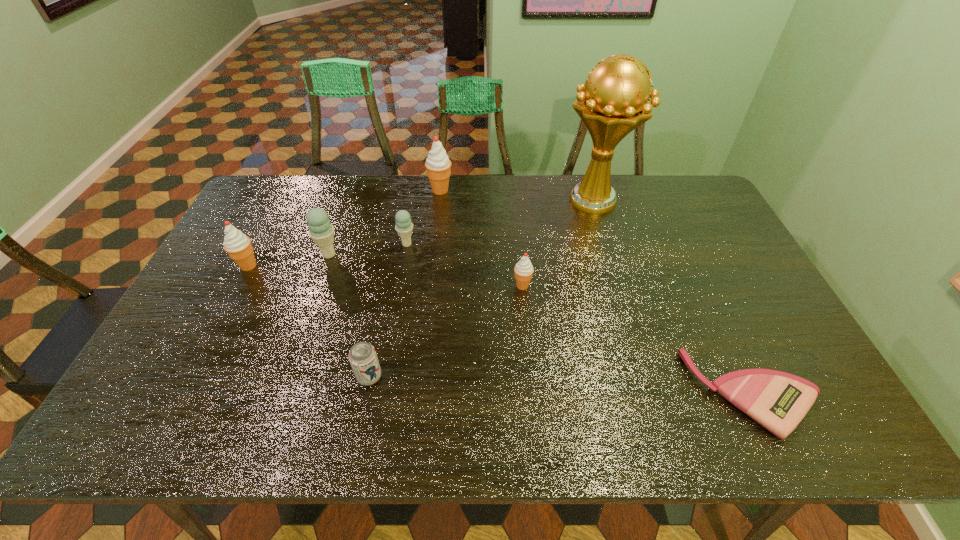
Where is `red icecream that is the closest to the seventh tallest object`? red icecream that is the closest to the seventh tallest object is located at coordinates click(x=523, y=269).

Locate an element on the screen. This screenshot has height=540, width=960. free space that satisfies the following two spatial constraints: 1. on the back side of the tallest icecream; 2. on the right side of the second icecream from left to right is located at coordinates (351, 190).

Locate an element on the screen. free space in the image that satisfies the following two spatial constraints: 1. on the front side of the tallest icecream; 2. on the right side of the smallest red icecream is located at coordinates (430, 286).

The width and height of the screenshot is (960, 540). In order to click on free space that satisfies the following two spatial constraints: 1. on the front side of the nearest red icecream; 2. on the left side of the farthest red icecream in this screenshot , I will do `click(430, 286)`.

Where is `blank space that satisfies the following two spatial constraints: 1. on the back side of the second icecream from left to right; 2. on the left side of the second icecream from right to left`? blank space that satisfies the following two spatial constraints: 1. on the back side of the second icecream from left to right; 2. on the left side of the second icecream from right to left is located at coordinates (351, 190).